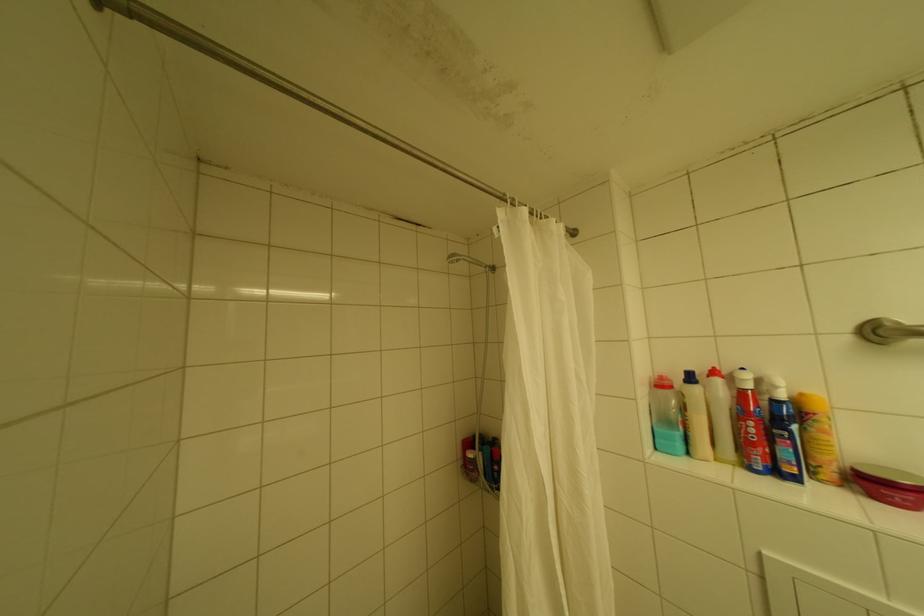
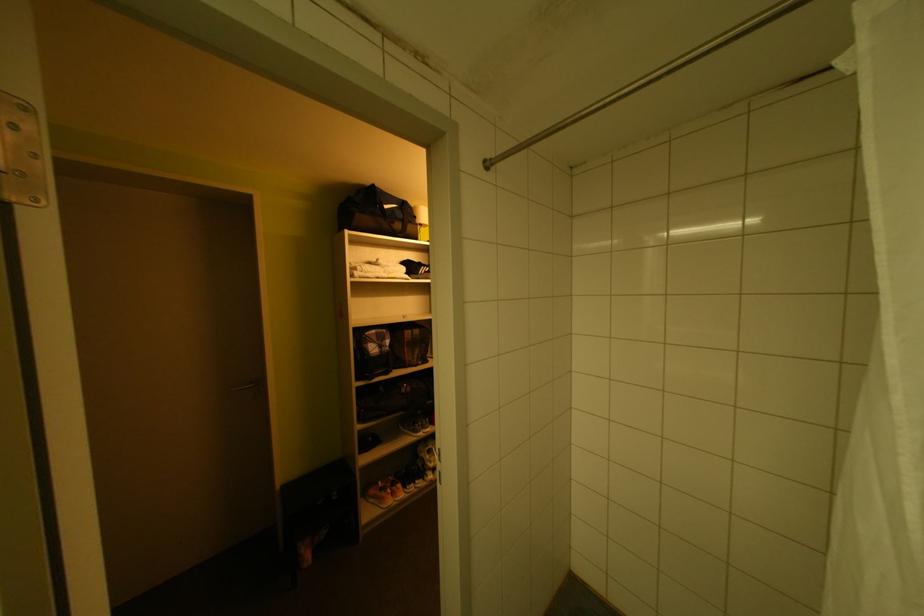
Question: The camera is either moving clockwise (left) or counter-clockwise (right) around the object. The first image is from the beginning of the video and the second image is from the end. Is the camera moving left or right when shooting the video?

Choices:
 (A) Left
 (B) Right

Answer: (B)